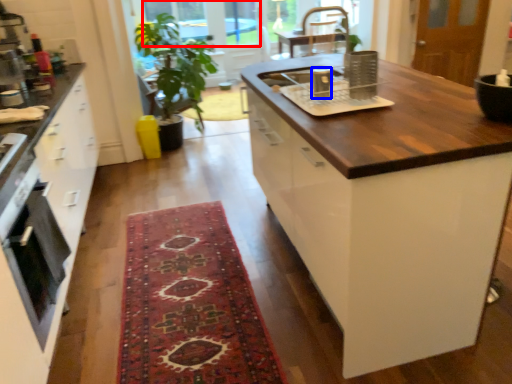
Question: Which object appears farthest to the camera in this image, window screen (highlighted by a red box) or appliance (highlighted by a blue box)?

Choices:
 (A) window screen
 (B) appliance

Answer: (A)